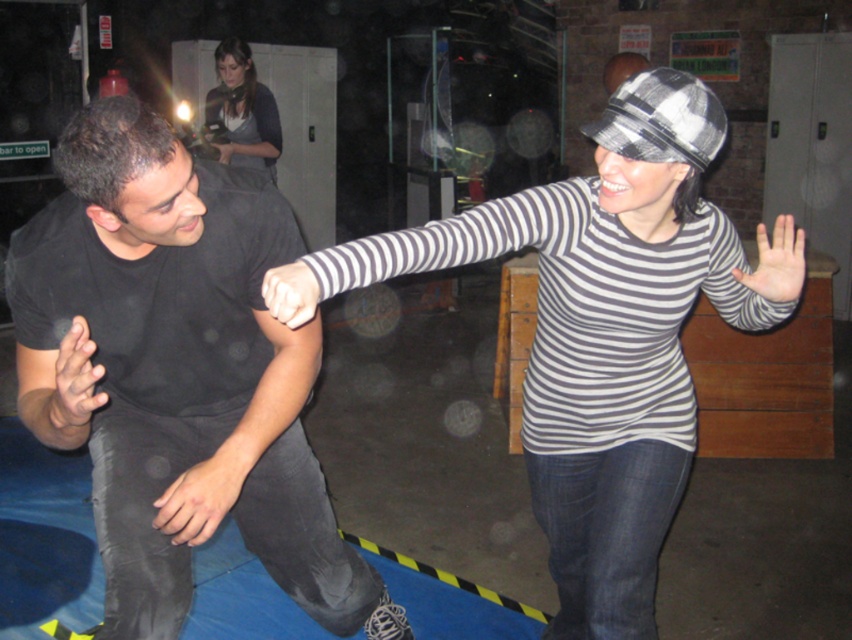
Question: Can you confirm if black matte shirt at left is smaller than matte gray sweater at upper center?

Choices:
 (A) yes
 (B) no

Answer: (B)

Question: Which object is farther from the camera taking this photo?

Choices:
 (A) striped cotton shirt at center
 (B) matte gray sweater at upper center

Answer: (B)

Question: Does striped cotton shirt at center appear under matte gray sweater at upper center?

Choices:
 (A) yes
 (B) no

Answer: (A)

Question: Is striped cotton shirt at center wider than matte gray sweater at upper center?

Choices:
 (A) no
 (B) yes

Answer: (B)

Question: Which point is farther to the camera?

Choices:
 (A) pyautogui.click(x=223, y=70)
 (B) pyautogui.click(x=642, y=381)

Answer: (A)

Question: Which object is positioned farthest from the matte gray sweater at upper center?

Choices:
 (A) striped cotton shirt at center
 (B) black matte shirt at left

Answer: (A)